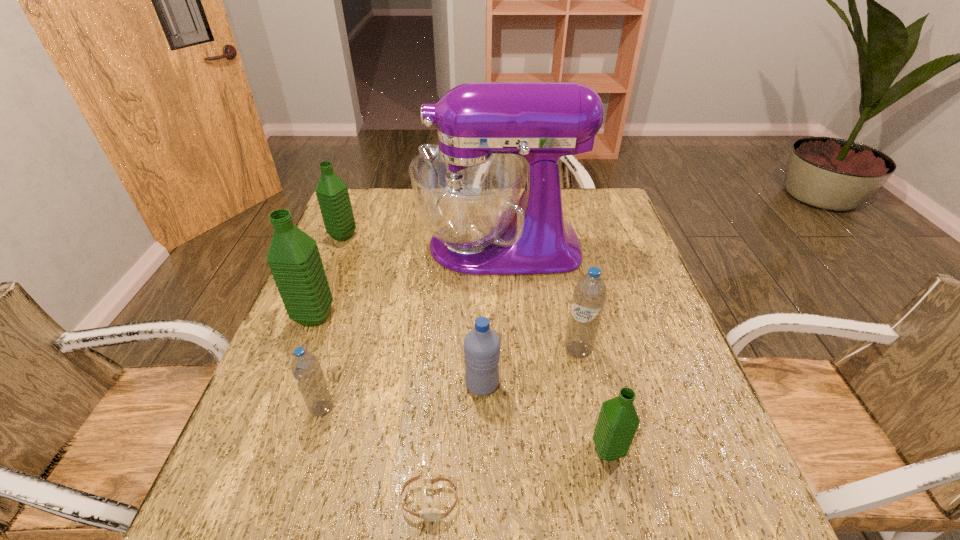
At what (x,y) coordinates should I click in order to perform the action: click on the tallest object. Please return your answer as a coordinate pair (x, y). Looking at the image, I should click on click(467, 189).

You are a GUI agent. You are given a task and a screenshot of the screen. Output one action in this format:
    pyautogui.click(x=<x>, y=<y>)
    Task: Click on the mixer
    This screenshot has width=960, height=540.
    Given the screenshot: What is the action you would take?
    pyautogui.click(x=467, y=189)

At what (x,y) coordinates should I click in order to perform the action: click on the second farthest green water bottle. Please return your answer as a coordinate pair (x, y). Looking at the image, I should click on (293, 257).

Locate an element on the screen. the biggest green water bottle is located at coordinates (293, 257).

Image resolution: width=960 pixels, height=540 pixels. I want to click on the farthest green water bottle, so click(332, 193).

Image resolution: width=960 pixels, height=540 pixels. What are the coordinates of `the farthest water bottle` in the screenshot? It's located at (332, 193).

Where is `the fifth nearest object`? The image size is (960, 540). the fifth nearest object is located at coordinates (589, 295).

At what (x,y) coordinates should I click in order to perform the action: click on the farthest blue water bottle. Please return your answer as a coordinate pair (x, y). Image resolution: width=960 pixels, height=540 pixels. Looking at the image, I should click on point(589,295).

The height and width of the screenshot is (540, 960). Identify the location of the fourth water bottle from left to right. (482, 345).

You are a GUI agent. You are given a task and a screenshot of the screen. Output one action in this format:
    pyautogui.click(x=<x>, y=<y>)
    Task: Click on the nearest green water bottle
    Image resolution: width=960 pixels, height=540 pixels.
    Given the screenshot: What is the action you would take?
    pyautogui.click(x=618, y=421)